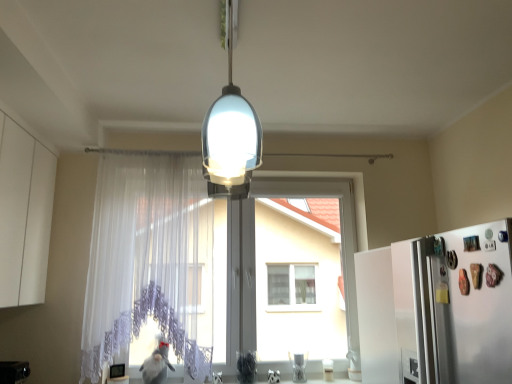
Question: From a real-world perspective, is white sheer curtain at center positioned under transparent lace curtain at center based on gravity?

Choices:
 (A) no
 (B) yes

Answer: (A)

Question: Can you confirm if white sheer curtain at center is thinner than transparent lace curtain at center?

Choices:
 (A) no
 (B) yes

Answer: (A)

Question: Is white sheer curtain at center positioned with its back to transparent lace curtain at center?

Choices:
 (A) no
 (B) yes

Answer: (B)

Question: From the image's perspective, is white sheer curtain at center located beneath transparent lace curtain at center?

Choices:
 (A) no
 (B) yes

Answer: (A)

Question: Is white sheer curtain at center at the right side of transparent lace curtain at center?

Choices:
 (A) no
 (B) yes

Answer: (A)

Question: Is white sheer curtain at center next to transparent lace curtain at center?

Choices:
 (A) yes
 (B) no

Answer: (B)

Question: Can you confirm if transparent lace curtain at center is wider than white sheer curtain at center?

Choices:
 (A) yes
 (B) no

Answer: (B)

Question: Is transparent lace curtain at center positioned before white sheer curtain at center?

Choices:
 (A) yes
 (B) no

Answer: (B)

Question: Does transparent lace curtain at center have a greater height compared to white sheer curtain at center?

Choices:
 (A) no
 (B) yes

Answer: (A)

Question: Is transparent lace curtain at center to the right of white sheer curtain at center from the viewer's perspective?

Choices:
 (A) yes
 (B) no

Answer: (A)

Question: From the image's perspective, is transparent lace curtain at center beneath white sheer curtain at center?

Choices:
 (A) no
 (B) yes

Answer: (B)

Question: Is transparent lace curtain at center with white sheer curtain at center?

Choices:
 (A) yes
 (B) no

Answer: (B)

Question: Can you confirm if translucent glass lampshade at center is thinner than white matte cabinet at left?

Choices:
 (A) no
 (B) yes

Answer: (A)